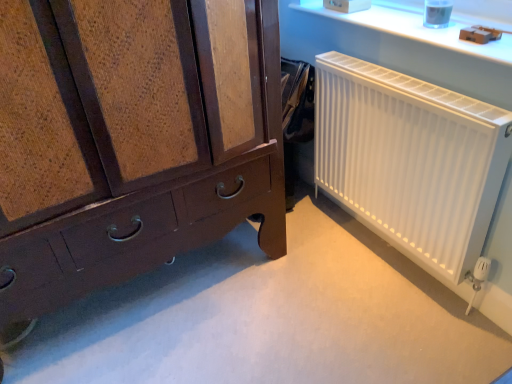
Question: Considering the positions of point (440, 44) and point (65, 226), is point (440, 44) closer or farther from the camera than point (65, 226)?

Choices:
 (A) closer
 (B) farther

Answer: (B)

Question: Would you say white plastic radiator at upper right is inside or outside matte brown wooden chest of drawers at lower left?

Choices:
 (A) inside
 (B) outside

Answer: (B)

Question: Which object is the farthest from the white matte radiator at right?

Choices:
 (A) matte brown wooden chest of drawers at lower left
 (B) white plastic radiator at upper right

Answer: (A)

Question: Considering the real-world distances, which object is farthest from the white matte radiator at right?

Choices:
 (A) white plastic radiator at upper right
 (B) matte brown wooden chest of drawers at lower left

Answer: (B)